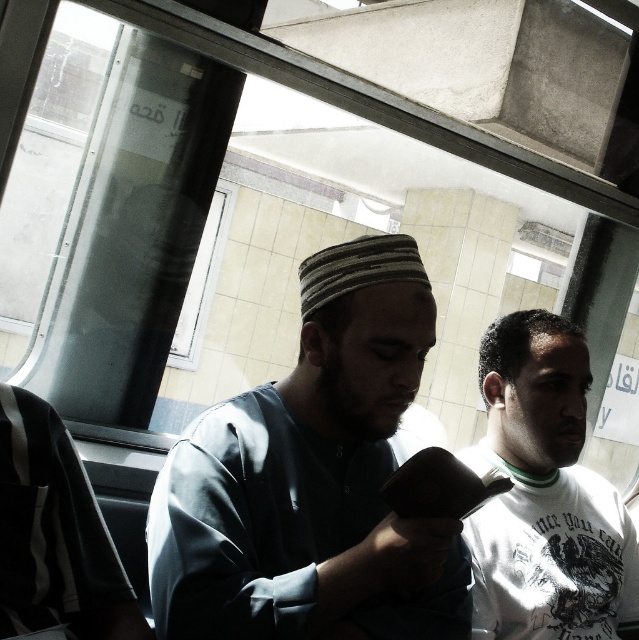
Question: Observing the image, what is the correct spatial positioning of light blue fabric shirt at center in reference to striped fabric shirt at left?

Choices:
 (A) above
 (B) below

Answer: (A)

Question: Which of the following is the closest to the observer?

Choices:
 (A) (355, 625)
 (B) (13, 624)

Answer: (B)

Question: Among these objects, which one is farthest from the camera?

Choices:
 (A) striped fabric shirt at left
 (B) white matte shirt at center
 (C) light blue fabric shirt at center

Answer: (B)

Question: Among these objects, which one is farthest from the camera?

Choices:
 (A) white matte shirt at center
 (B) striped fabric shirt at left
 (C) light blue fabric shirt at center

Answer: (A)

Question: Is the position of white matte shirt at center more distant than that of striped fabric shirt at left?

Choices:
 (A) no
 (B) yes

Answer: (B)

Question: Is the position of light blue fabric shirt at center more distant than that of white matte shirt at center?

Choices:
 (A) no
 (B) yes

Answer: (A)